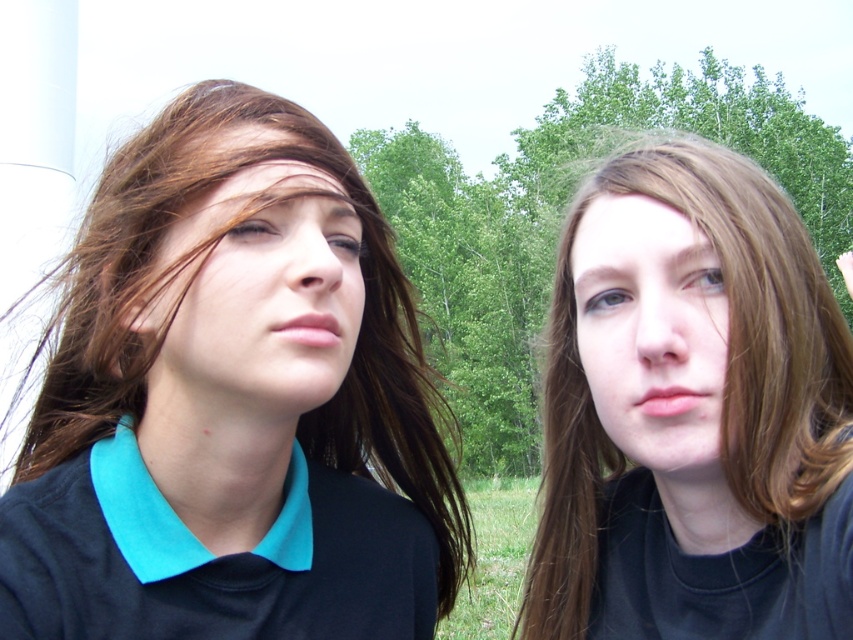
You are a photographer standing at the center of the image. You want to focus your camera on the smooth brown hair at upper right. According to the coordinates provided, what is the exact location you should aim your camera at?

The exact coordinates to aim the camera at are point (x=691, y=412).

From the picture: Based on the scene description, which object is positioned to the left of the other? The matte black shirt at left and the smooth brown hair at upper right are both visible in the image. Please determine their spatial relationship.

The matte black shirt at left is to the left of smooth brown hair at upper right according to the description.

You are standing in the park and see two points in the image. The first point is at coordinate point (x=341, y=160) and the second point is at coordinate point (x=616, y=435). Which point is closer to you?

Point (x=341, y=160) is further to the camera than point (x=616, y=435), so the point closer to you is point (x=616, y=435).